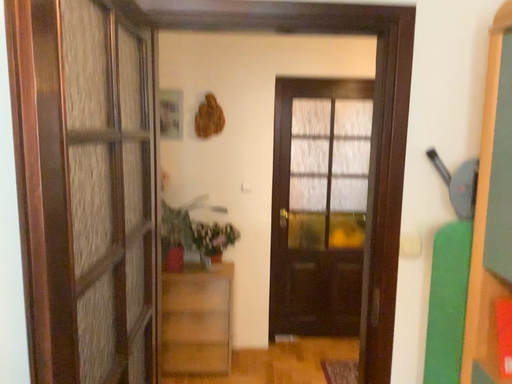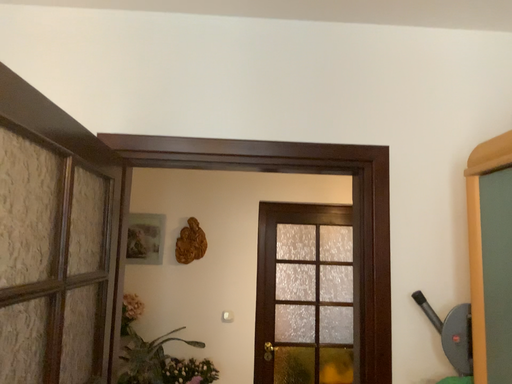
Question: Which way did the camera rotate in the video?

Choices:
 (A) rotated downward
 (B) rotated upward

Answer: (B)